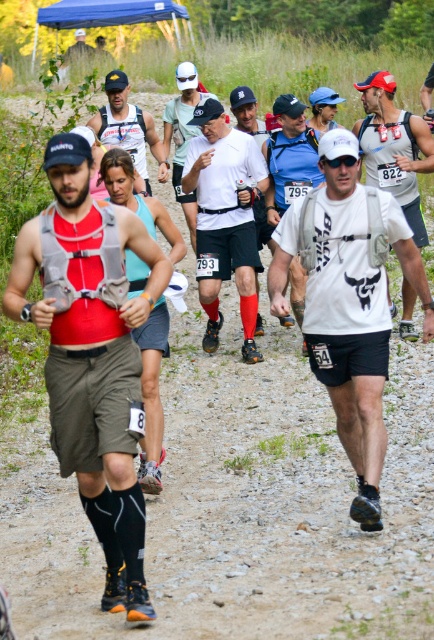
Which is above, white matte t-shirt at center or blue fabric shirt at center?

Positioned higher is blue fabric shirt at center.

Does white matte t-shirt at center have a greater width compared to blue fabric shirt at center?

Correct, the width of white matte t-shirt at center exceeds that of blue fabric shirt at center.

Is point (315, 204) closer to viewer compared to point (302, 124)?

Yes, point (315, 204) is in front of point (302, 124).

What are the coordinates of `white matte t-shirt at center` in the screenshot? It's located at (348, 301).

Does matte gray vest at left appear on the right side of white matte shirt at center?

No, matte gray vest at left is not to the right of white matte shirt at center.

Can you confirm if matte gray vest at left is positioned below white matte shirt at center?

Correct, matte gray vest at left is located below white matte shirt at center.

Identify the location of matte gray vest at left. (92, 355).

The image size is (434, 640). What do you see at coordinates (224, 218) in the screenshot? I see `white matte shirt at center` at bounding box center [224, 218].

In the scene shown: Does white matte shirt at center appear under blue fabric shirt at center?

Correct, white matte shirt at center is located below blue fabric shirt at center.

Between point (250, 312) and point (299, 273), which one is positioned in front?

Positioned in front is point (299, 273).

Image resolution: width=434 pixels, height=640 pixels. Identify the location of white matte shirt at center. (224, 218).